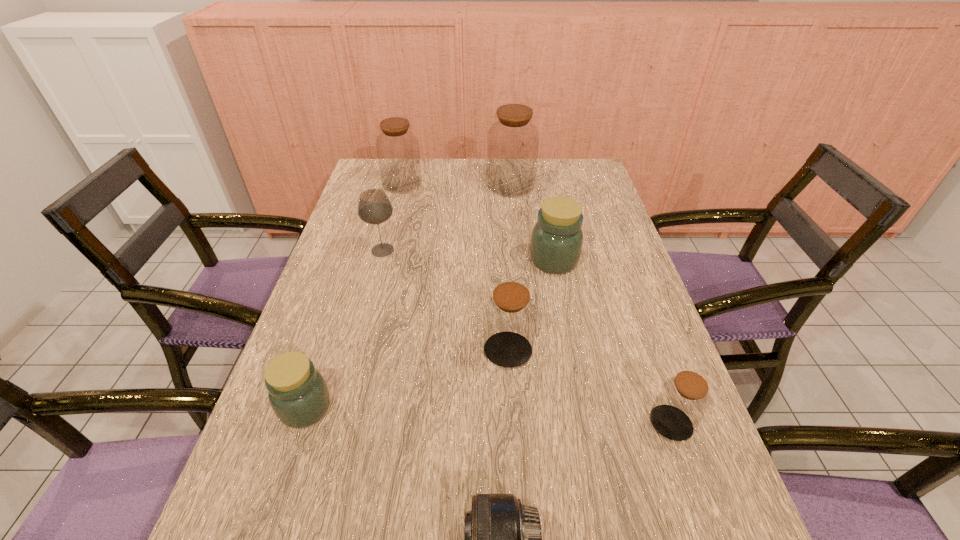
Image resolution: width=960 pixels, height=540 pixels. Find the location of `wineglass located in the left edge section of the desktop`. wineglass located in the left edge section of the desktop is located at coordinates coord(374,207).

The image size is (960, 540). I want to click on object that is positioned at the far left corner, so click(397, 147).

In the image, there is a desktop. At what (x,y) coordinates should I click in order to perform the action: click on free space at the far edge. Please return your answer as a coordinate pair (x, y). Image resolution: width=960 pixels, height=540 pixels. Looking at the image, I should click on (469, 164).

In the image, there is a desktop. Where is `vacant area at the left edge`? vacant area at the left edge is located at coordinates (338, 339).

This screenshot has width=960, height=540. What are the coordinates of `vacant space at the right edge of the desktop` in the screenshot? It's located at (687, 539).

What are the coordinates of `vacant area that lies between the smaller green jar and the smallest brown jar` in the screenshot? It's located at (489, 415).

The width and height of the screenshot is (960, 540). What are the coordinates of `free space between the left green jar and the wineglass` in the screenshot? It's located at (344, 329).

Locate an element on the screen. free area in between the bigger green jar and the fifth shortest jar is located at coordinates pos(478,222).

You are a GUI agent. You are given a task and a screenshot of the screen. Output one action in this format:
    pyautogui.click(x=<x>, y=<y>)
    Task: Click on the empty space between the wineglass and the tallest object
    This screenshot has height=540, width=960.
    Given the screenshot: What is the action you would take?
    pyautogui.click(x=446, y=218)

I want to click on blank region between the wineglass and the nearer green jar, so coord(344,329).